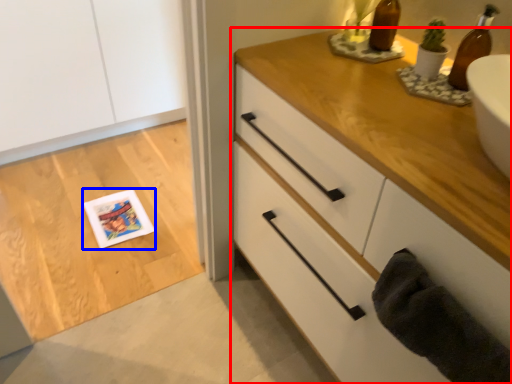
Question: Which of the following is the closest to the observer, chest of drawers (highlighted by a red box) or postcard (highlighted by a blue box)?

Choices:
 (A) chest of drawers
 (B) postcard

Answer: (A)